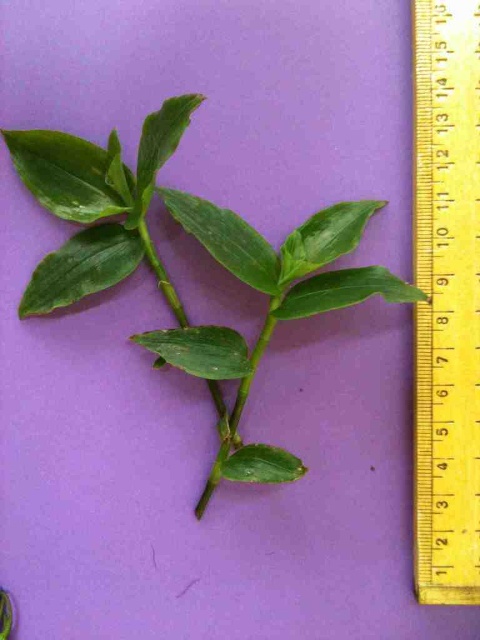
You are an artist sketching the plant and need to know which object is closer to you. Which is closer, the green matte leafy branch at center or the yellow plastic ruler at right?

The green matte leafy branch at center is closer to you than the yellow plastic ruler at right.

From the picture: You are a photographer trying to capture a closeup of the plant stem. You notice two points marked in the image at coordinates point (250, 464) and point (450, 522). Which point should you focus on to ensure the closest part of the plant is in sharp focus?

You should focus on point (250, 464) because it is closer to the camera than point (450, 522), ensuring the closest part of the plant is in sharp focus.